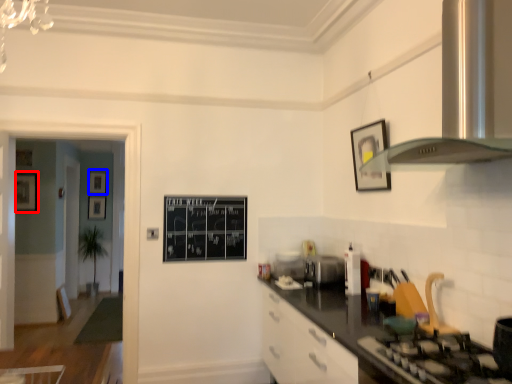
Question: Which object appears closest to the camera in this image, picture frame (highlighted by a red box) or picture frame (highlighted by a blue box)?

Choices:
 (A) picture frame
 (B) picture frame

Answer: (A)